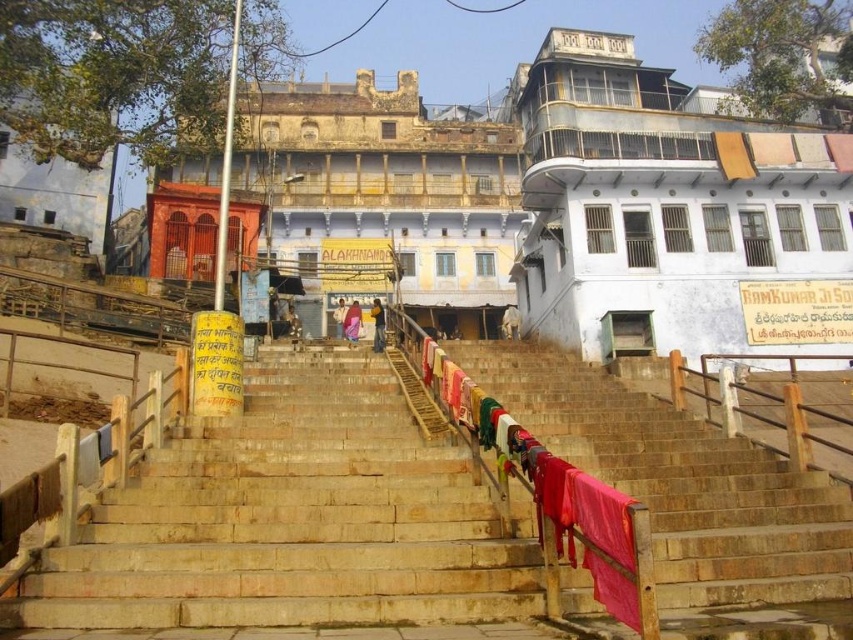
You are standing at the bottom of the stone steps and want to take a photo of the white plaster temple at center and the white cotton cloth at center. Which object will appear larger in the photo?

The white plaster temple at center will appear larger in the photo because it is closer to you than the white cotton cloth at center.

Based on the photo, you are standing at the bottom of the stone steps and want to take a photo of the white painted building at upper right and the white fabric at center. Which object should you focus on first if you want to capture both in a single frame without moving the camera?

You should focus on the white fabric at center first because the white painted building at upper right is positioned to its right, so by centering the white fabric at center, the building will naturally fall into the frame on the right side.